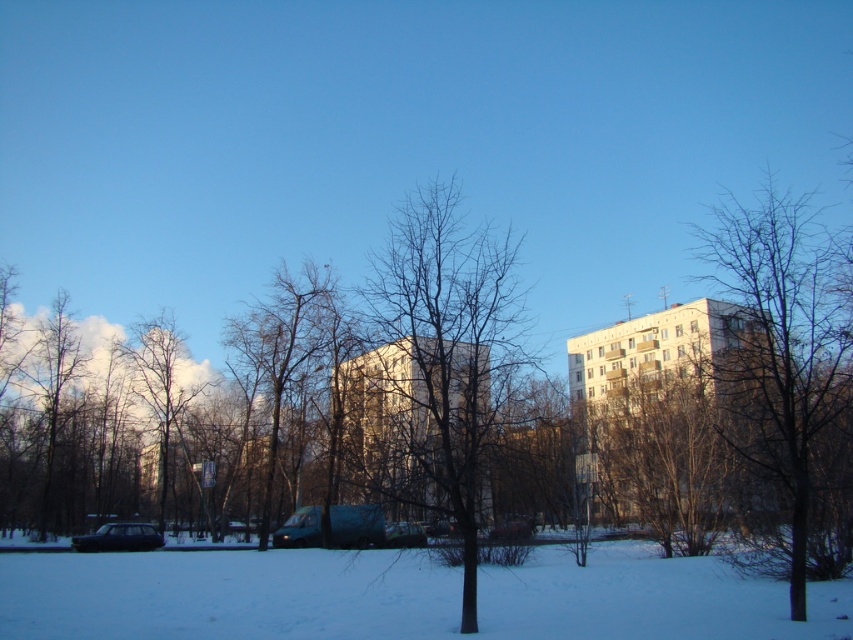
You are standing in the winter scene and want to place two markers at the locations of point (463, 561) and point (370, 524). Which marker will be closer to you?

Point (463, 561) is closer to the viewer than point (370, 524), so the marker at point (463, 561) will be closer to you.

You are a delivery driver who needs to park your vehicle between the metallic green van at center and the shiny black car at lower left. Is there enough space between them to fit your car, which is 5 meters long?

The metallic green van at center is to the right of the shiny black car at lower left, but the distance between them isn not specified in the Objects Description. Therefore, it is impossible to determine if there is enough space to fit a 5 meter long car between them.